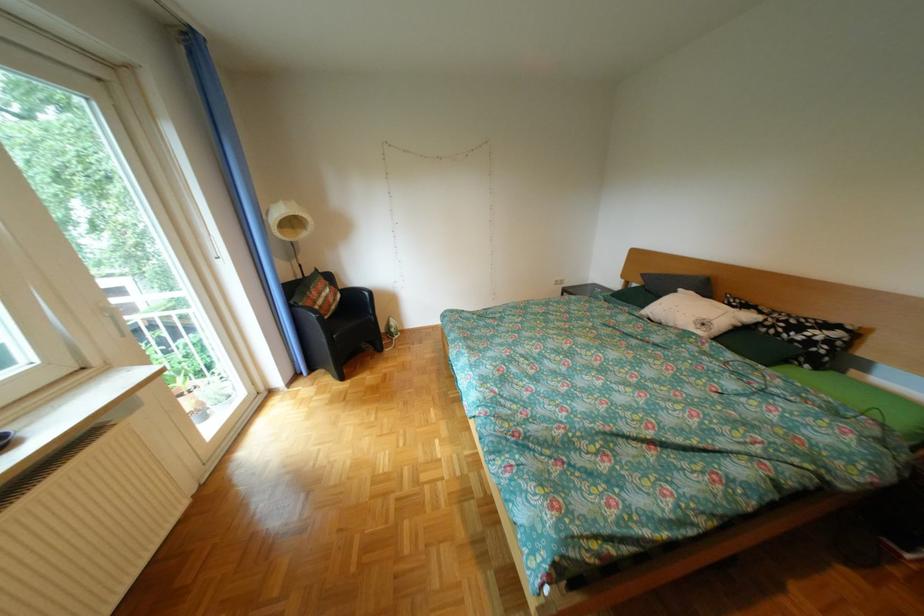
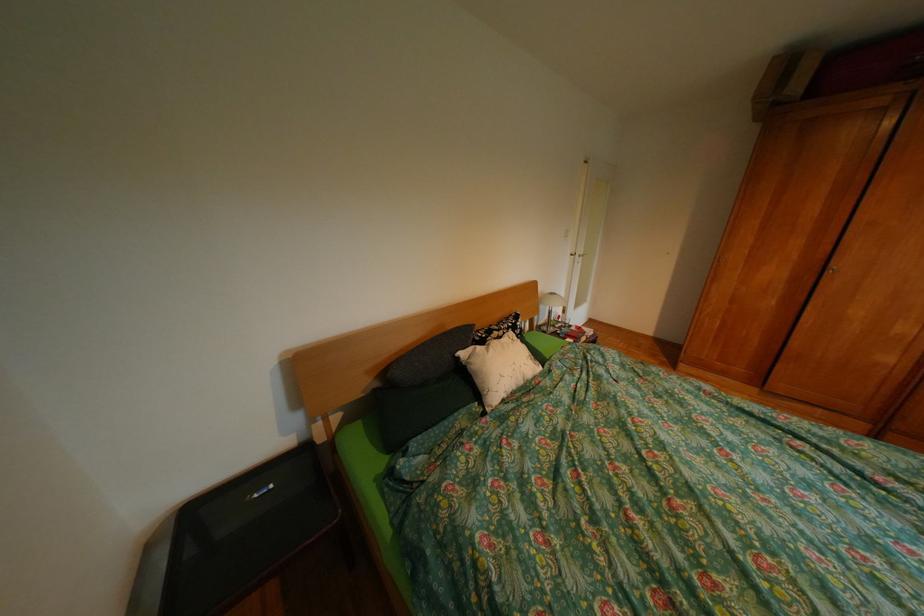
The point at (695, 291) is marked in the first image. Where is the corresponding point in the second image?

(477, 354)